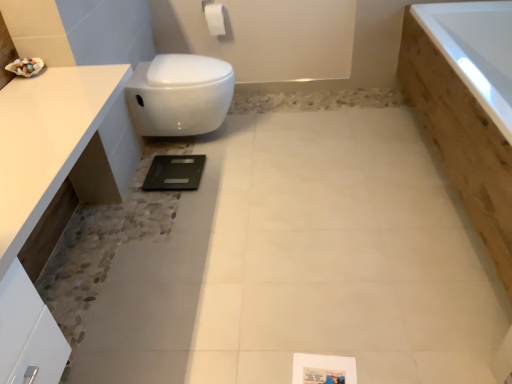
Where is `empty space that is ontop of white glossy countertop at upper left (from a real-world perspective)`? empty space that is ontop of white glossy countertop at upper left (from a real-world perspective) is located at coordinates (39, 120).